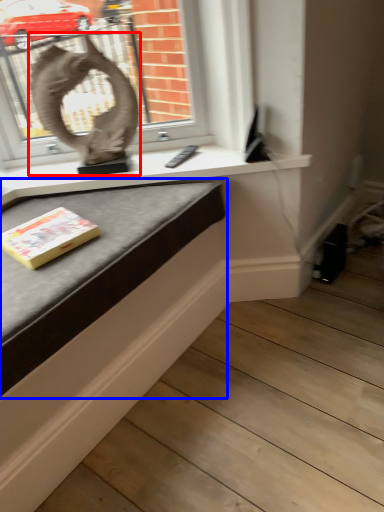
Question: Which of the following is the farthest to the observer, sculpture (highlighted by a red box) or table (highlighted by a blue box)?

Choices:
 (A) sculpture
 (B) table

Answer: (A)